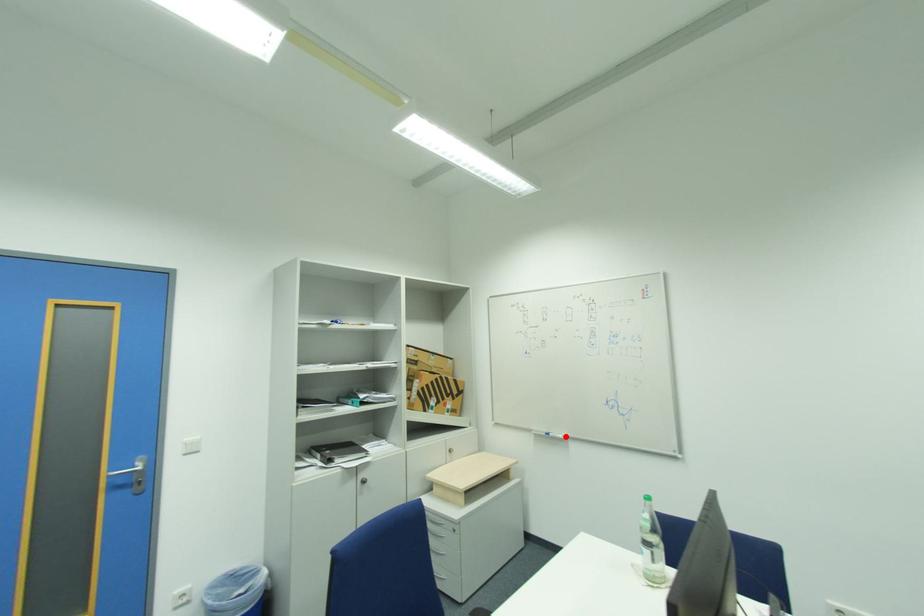
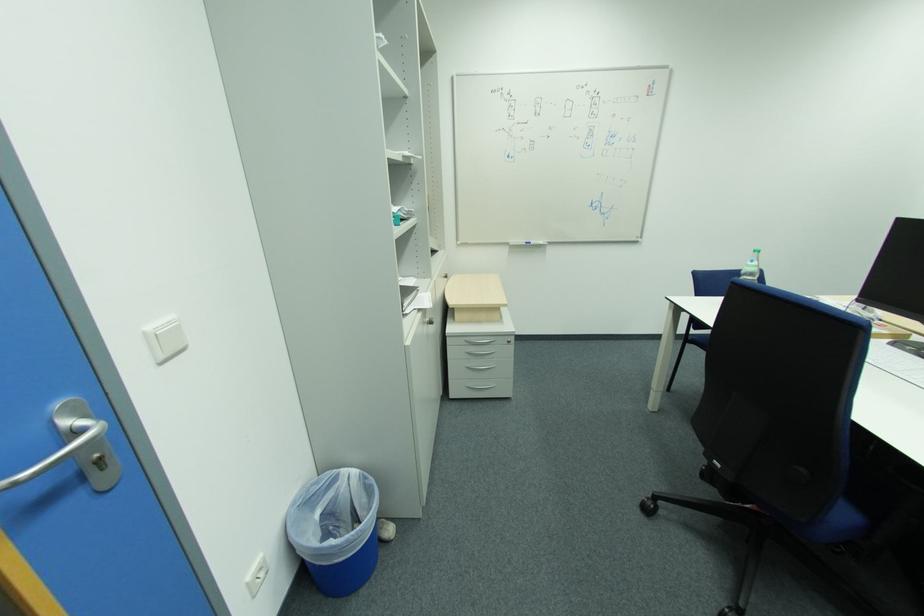
Where in the second image is the point corresponding to the highlighted location from the first image?

(546, 244)